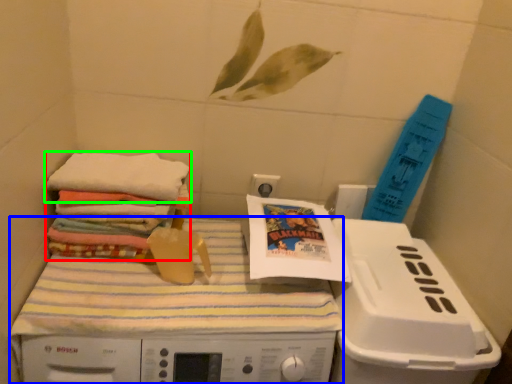
Question: Estimate the real-world distances between objects in this image. Which object is farther from material (highlighted by a red box), machine (highlighted by a blue box) or towel (highlighted by a green box)?

Choices:
 (A) machine
 (B) towel

Answer: (A)